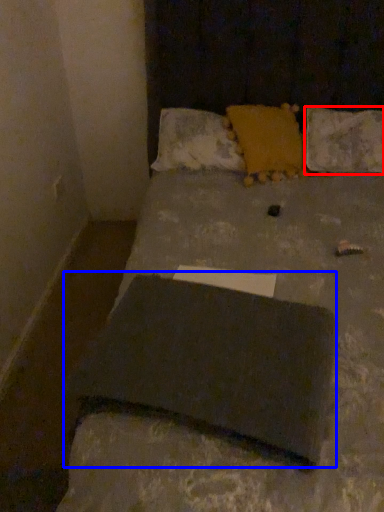
Question: Which object appears closest to the camera in this image, pillow (highlighted by a red box) or slate (highlighted by a blue box)?

Choices:
 (A) pillow
 (B) slate

Answer: (B)